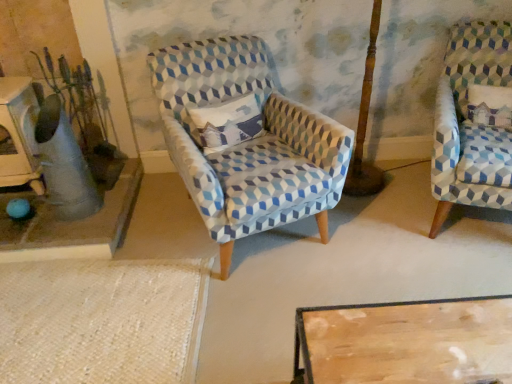
Question: From a real-world perspective, is matte gray vase at left physically below blue patterned fabric chair at center, the 2th chair positioned from the right?

Choices:
 (A) yes
 (B) no

Answer: (B)

Question: Is matte gray vase at left wider than blue patterned fabric chair at center, the 2th chair positioned from the right?

Choices:
 (A) no
 (B) yes

Answer: (A)

Question: Does matte gray vase at left come behind blue patterned fabric chair at center, acting as the 1th chair starting from the left?

Choices:
 (A) no
 (B) yes

Answer: (B)

Question: Does matte gray vase at left appear on the right side of blue patterned fabric chair at center, acting as the 1th chair starting from the left?

Choices:
 (A) yes
 (B) no

Answer: (B)

Question: Considering the relative sizes of matte gray vase at left and blue patterned fabric chair at center, the 2th chair positioned from the right, in the image provided, is matte gray vase at left taller than blue patterned fabric chair at center, the 2th chair positioned from the right,?

Choices:
 (A) yes
 (B) no

Answer: (B)

Question: Does point (80, 231) appear closer or farther from the camera than point (476, 173)?

Choices:
 (A) closer
 (B) farther

Answer: (B)

Question: From the image's perspective, relative to blue-patterned fabric chair at right, positioned as the first chair in right-to-left order, is matte gray concrete table at left above or below?

Choices:
 (A) above
 (B) below

Answer: (B)

Question: From a real-world perspective, relative to blue-patterned fabric chair at right, which is counted as the 2th chair, starting from the left, is matte gray concrete table at left vertically above or below?

Choices:
 (A) above
 (B) below

Answer: (B)

Question: Considering the positions of matte gray concrete table at left and blue-patterned fabric chair at right, positioned as the first chair in right-to-left order, in the image, is matte gray concrete table at left taller or shorter than blue-patterned fabric chair at right, positioned as the first chair in right-to-left order,?

Choices:
 (A) tall
 (B) short

Answer: (B)

Question: Is matte gray vase at left taller or shorter than blue-patterned fabric chair at right, which is counted as the 2th chair, starting from the left?

Choices:
 (A) short
 (B) tall

Answer: (A)

Question: In the image, is matte gray vase at left positioned in front of or behind blue-patterned fabric chair at right, positioned as the first chair in right-to-left order?

Choices:
 (A) front
 (B) behind

Answer: (B)

Question: Considering the positions of matte gray vase at left and blue-patterned fabric chair at right, which is counted as the 2th chair, starting from the left, in the image, is matte gray vase at left wider or thinner than blue-patterned fabric chair at right, which is counted as the 2th chair, starting from the left,?

Choices:
 (A) thin
 (B) wide

Answer: (A)

Question: From the image's perspective, is matte gray vase at left above or below blue-patterned fabric chair at right, which is counted as the 2th chair, starting from the left?

Choices:
 (A) below
 (B) above

Answer: (B)

Question: Does point (458, 200) appear closer or farther from the camera than point (92, 127)?

Choices:
 (A) closer
 (B) farther

Answer: (A)

Question: Is blue-patterned fabric chair at right, positioned as the first chair in right-to-left order, inside or outside of matte gray vase at left?

Choices:
 (A) inside
 (B) outside

Answer: (B)